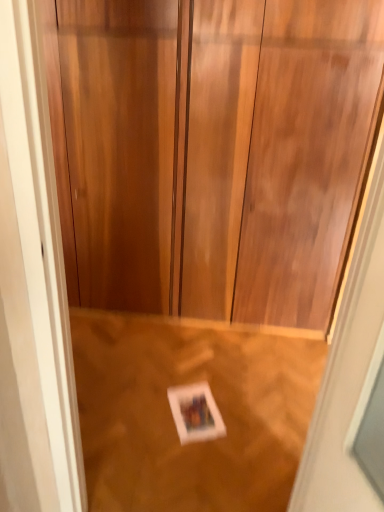
Question: Is wooden door at center not near wooden floor at lower center?

Choices:
 (A) no
 (B) yes

Answer: (A)

Question: Can you see wooden door at center touching wooden floor at lower center?

Choices:
 (A) yes
 (B) no

Answer: (B)

Question: Is wooden door at center closer to camera compared to wooden floor at lower center?

Choices:
 (A) no
 (B) yes

Answer: (B)

Question: From a real-world perspective, is wooden door at center positioned over wooden floor at lower center based on gravity?

Choices:
 (A) no
 (B) yes

Answer: (B)

Question: From a real-world perspective, is wooden door at center below wooden floor at lower center?

Choices:
 (A) yes
 (B) no

Answer: (B)

Question: Is wooden door at center turned away from wooden floor at lower center?

Choices:
 (A) no
 (B) yes

Answer: (A)

Question: Can you confirm if wooden floor at lower center is shorter than white paper at center?

Choices:
 (A) yes
 (B) no

Answer: (B)

Question: From a real-world perspective, does wooden floor at lower center stand above white paper at center?

Choices:
 (A) yes
 (B) no

Answer: (A)

Question: Considering the relative sizes of wooden floor at lower center and white paper at center in the image provided, is wooden floor at lower center taller than white paper at center?

Choices:
 (A) no
 (B) yes

Answer: (B)

Question: Is wooden floor at lower center oriented away from white paper at center?

Choices:
 (A) no
 (B) yes

Answer: (B)

Question: Can you confirm if wooden floor at lower center is smaller than white paper at center?

Choices:
 (A) no
 (B) yes

Answer: (A)

Question: From a real-world perspective, is wooden floor at lower center located beneath white paper at center?

Choices:
 (A) no
 (B) yes

Answer: (A)

Question: Does wooden floor at lower center have a lesser height compared to wooden door at center?

Choices:
 (A) yes
 (B) no

Answer: (A)